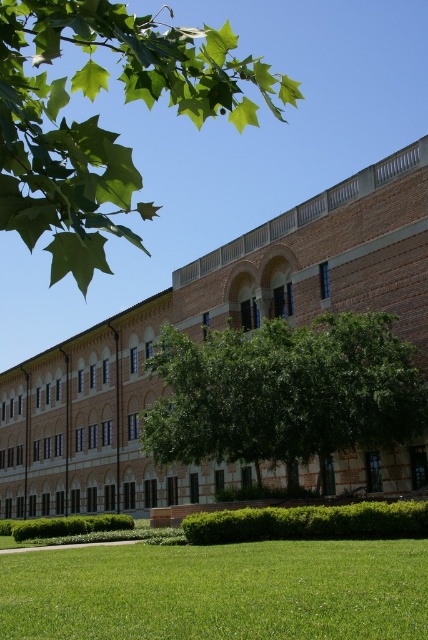
Between green leafy tree at upper left and green grass at lower center, which one has more height?

green leafy tree at upper left is taller.

Is point (216, 96) closer to camera compared to point (356, 557)?

Yes, point (216, 96) is in front of point (356, 557).

Is point (73, 195) closer to viewer compared to point (198, 573)?

That is True.

In order to click on green leafy tree at upper left in this screenshot , I will do `click(98, 116)`.

Can you confirm if green grass at lower center is bigger than green leafy tree at center?

No, green grass at lower center is not bigger than green leafy tree at center.

Measure the distance between green grass at lower center and camera.

60.58 feet

Is point (306, 550) farther from camera compared to point (392, 422)?

No, (306, 550) is closer to viewer.

Where is `green grass at lower center`? The width and height of the screenshot is (428, 640). green grass at lower center is located at coordinates (219, 592).

Can you confirm if green leafy tree at upper left is positioned to the right of green leafy tree at center?

In fact, green leafy tree at upper left is to the left of green leafy tree at center.

Between green leafy tree at upper left and green leafy tree at center, which one is positioned higher?

green leafy tree at upper left is above.

This screenshot has width=428, height=640. Find the location of `green leafy tree at upper left`. green leafy tree at upper left is located at coordinates (98, 116).